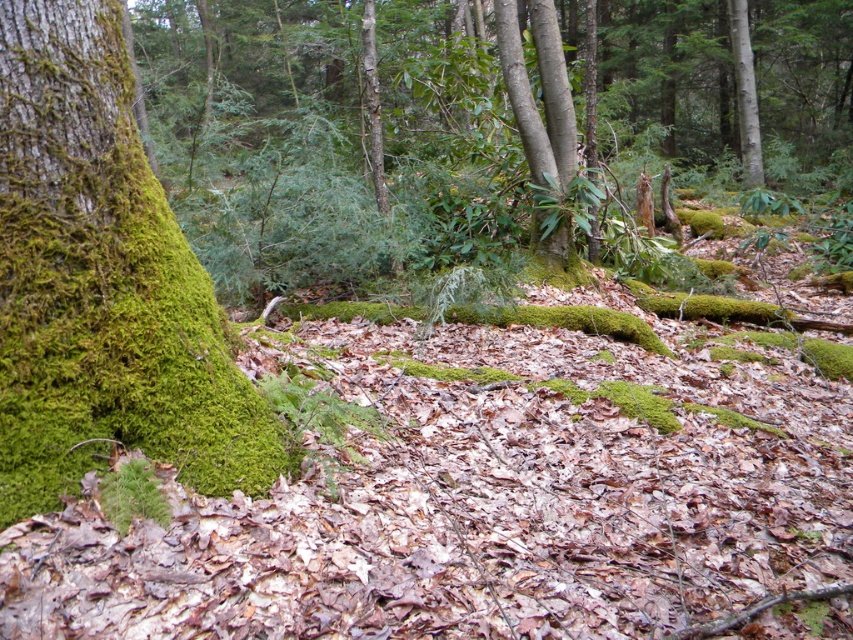
Does green mossy tree trunk at left appear on the left side of smooth bark tree at center?

Yes, green mossy tree trunk at left is to the left of smooth bark tree at center.

Based on the photo, is green mossy tree trunk at left taller than smooth bark tree at center?

Incorrect, green mossy tree trunk at left's height is not larger of smooth bark tree at center's.

What do you see at coordinates (102, 282) in the screenshot? I see `green mossy tree trunk at left` at bounding box center [102, 282].

Where is `green mossy tree trunk at left`? green mossy tree trunk at left is located at coordinates click(102, 282).